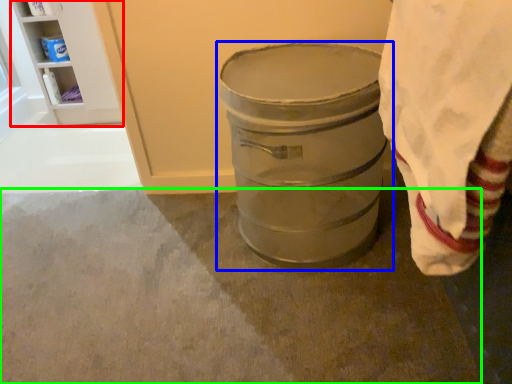
Question: Based on their relative distances, which object is nearer to shelf (highlighted by a red box)? Choose from waste container (highlighted by a blue box) and concrete (highlighted by a green box).

Choices:
 (A) waste container
 (B) concrete

Answer: (B)